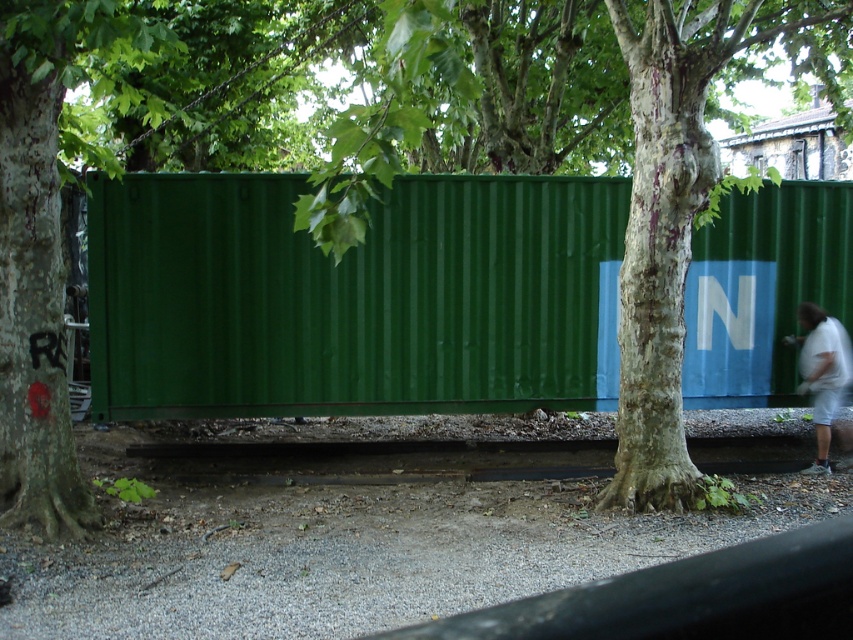
Question: Can you confirm if green corrugated metal shipping container at center is wider than white cotton shirt at right?

Choices:
 (A) no
 (B) yes

Answer: (A)

Question: Is green corrugated metal shipping container at center positioned in front of white cotton shirt at right?

Choices:
 (A) no
 (B) yes

Answer: (A)

Question: Is green corrugated metal shipping container at center wider than white cotton shirt at right?

Choices:
 (A) yes
 (B) no

Answer: (B)

Question: Which point is farther from the camera taking this photo?

Choices:
 (A) (460, 401)
 (B) (817, 424)

Answer: (A)